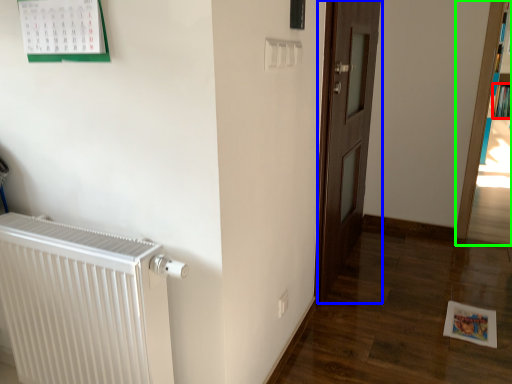
Question: Considering the real-world distances, which object is farthest from book (highlighted by a red box)? door (highlighted by a blue box) or bookcase (highlighted by a green box)?

Choices:
 (A) door
 (B) bookcase

Answer: (A)